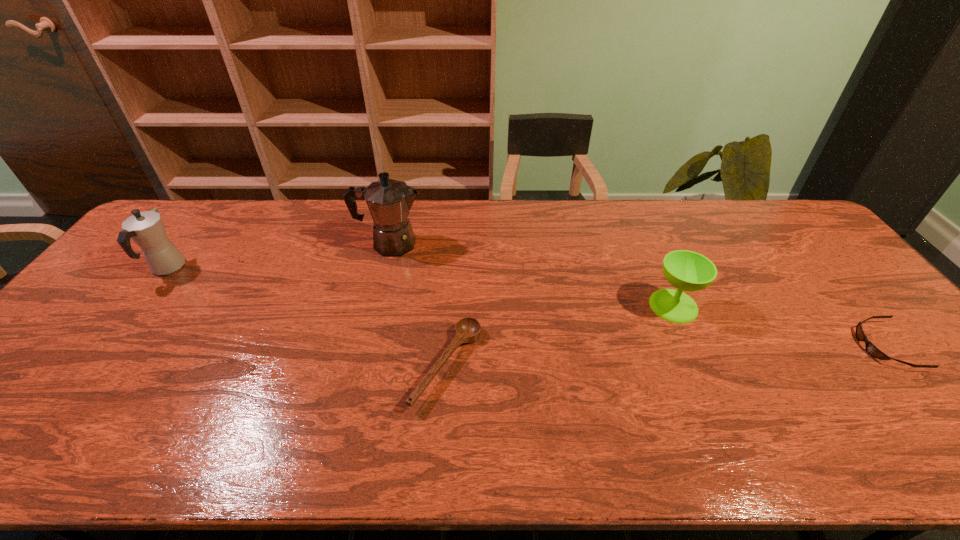
This screenshot has width=960, height=540. What are the coordinates of `vacant position located 0.240m on the pouring side of the tallest object` in the screenshot? It's located at (499, 244).

The height and width of the screenshot is (540, 960). What are the coordinates of `free space located 0.240m on the front of the shorter coffeepot` in the screenshot? It's located at (102, 353).

Where is `free spot located on the back of the third tallest object`? free spot located on the back of the third tallest object is located at coordinates (654, 262).

The height and width of the screenshot is (540, 960). I want to click on free space located 0.110m on the front of the fourth tallest object, so click(x=441, y=462).

Locate an element on the screen. free spot located on the front-facing side of the rightmost object is located at coordinates (715, 346).

Locate an element on the screen. The image size is (960, 540). vacant space located 0.110m on the front-facing side of the rightmost object is located at coordinates (818, 346).

Identify the location of free space located on the front-facing side of the rightmost object. (818, 346).

Identify the location of object present at the far edge. (389, 201).

At what (x,y) coordinates should I click in order to perform the action: click on object located in the left edge section of the desktop. Please return your answer as a coordinate pair (x, y). The image size is (960, 540). Looking at the image, I should click on (146, 229).

This screenshot has height=540, width=960. What are the coordinates of `object present at the right edge` in the screenshot? It's located at (870, 348).